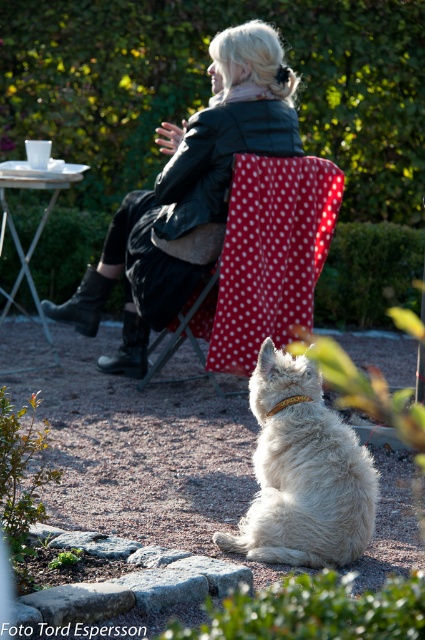
Which is behind, point (322, 552) or point (266, 88)?

Point (266, 88)

Is white fluffy dog at lower center behind matte black neckband at upper center?

That is False.

Where is `white fluffy dog at lower center`? white fluffy dog at lower center is located at coordinates (303, 474).

What are the coordinates of `white fluffy dog at lower center` in the screenshot? It's located at (303, 474).

Which is in front, point (240, 166) or point (215, 97)?

Point (240, 166) is more forward.

Does white polka dot fabric chair at center appear over matte black neckband at upper center?

No, white polka dot fabric chair at center is not above matte black neckband at upper center.

Does point (320, 168) come farther from viewer compared to point (234, 99)?

No.

Identify the location of white polka dot fabric chair at center. The image size is (425, 640). (260, 262).

Between point (254, 323) and point (309, 540), which one is positioned behind?

The point (254, 323) is more distant.

Locate an element on the screen. white polka dot fabric chair at center is located at coordinates (260, 262).